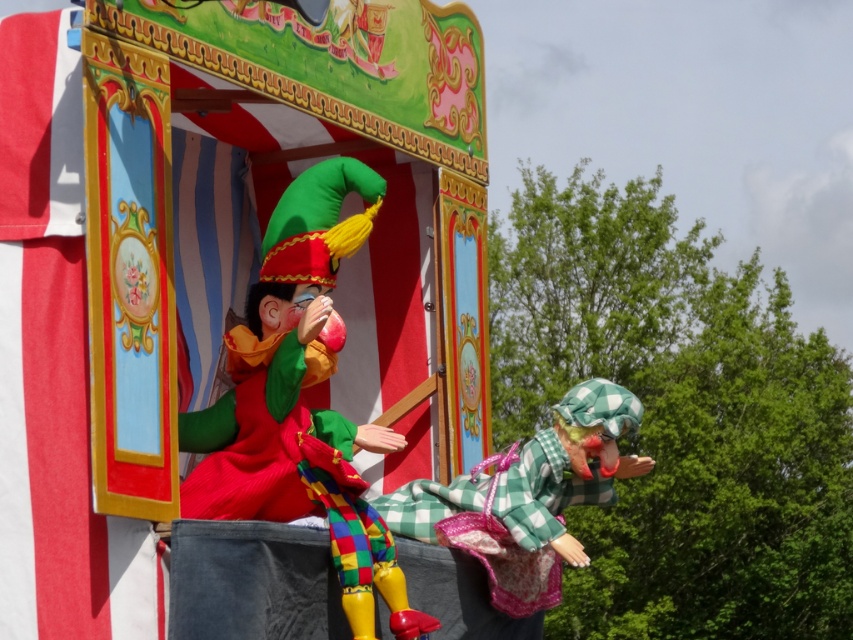
Who is more distant from viewer, (x=274, y=256) or (x=625, y=432)?

The point (x=625, y=432) is more distant.

How much distance is there between matte plastic clown at center and green checkered dress at center?

5.78 meters

Who is more forward, (367, 624) or (489, 477)?

Point (367, 624) is more forward.

The image size is (853, 640). Identify the location of matte plastic clown at center. click(300, 401).